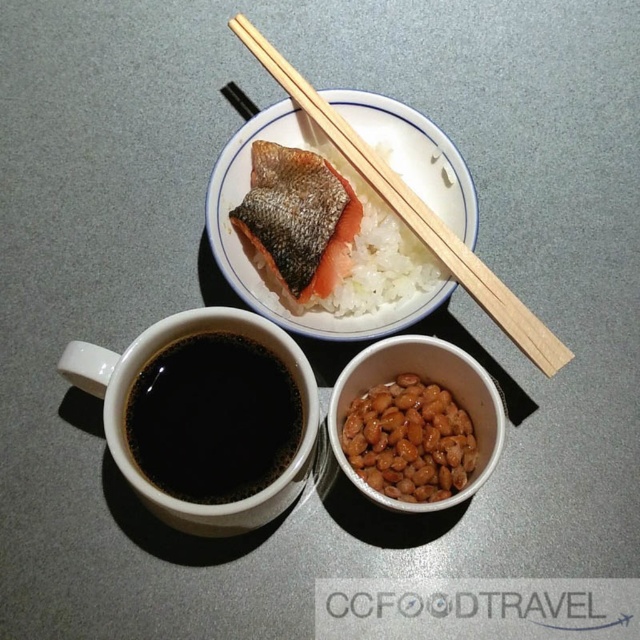
Question: Which object appears closest to the camera in this image?

Choices:
 (A) pinkish-orange flesh at center
 (B) black matte cup at lower left

Answer: (B)

Question: Is the position of shiny brown beans at center less distant than that of wooden chopsticks at upper center?

Choices:
 (A) yes
 (B) no

Answer: (A)

Question: Is black matte cup at lower left closer to the viewer compared to white polished rice at center?

Choices:
 (A) no
 (B) yes

Answer: (B)

Question: Which of these objects is positioned closest to the wooden chopsticks at upper center?

Choices:
 (A) pinkish-orange flesh at center
 (B) black matte cup at lower left
 (C) white polished rice at center
 (D) shiny brown beans at center

Answer: (C)

Question: Is white polished rice at center bigger than pinkish-orange flesh at center?

Choices:
 (A) yes
 (B) no

Answer: (A)

Question: Which is farther from the white polished rice at center?

Choices:
 (A) pinkish-orange flesh at center
 (B) black matte cup at lower left
 (C) wooden chopsticks at upper center
 (D) shiny brown beans at center

Answer: (B)